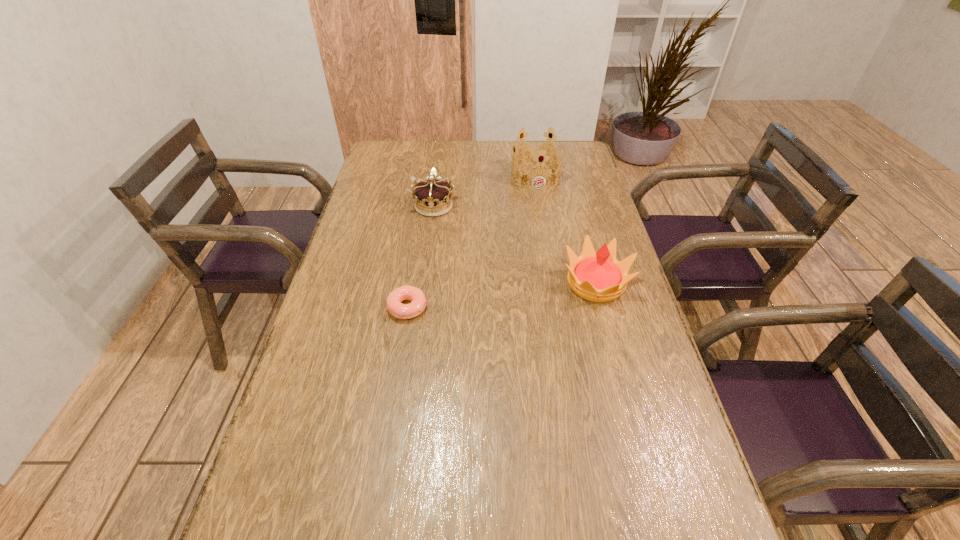
The image size is (960, 540). Identify the location of free spot that satisfies the following two spatial constraints: 1. on the back side of the farthest crown; 2. on the right side of the doughnut. (428, 177).